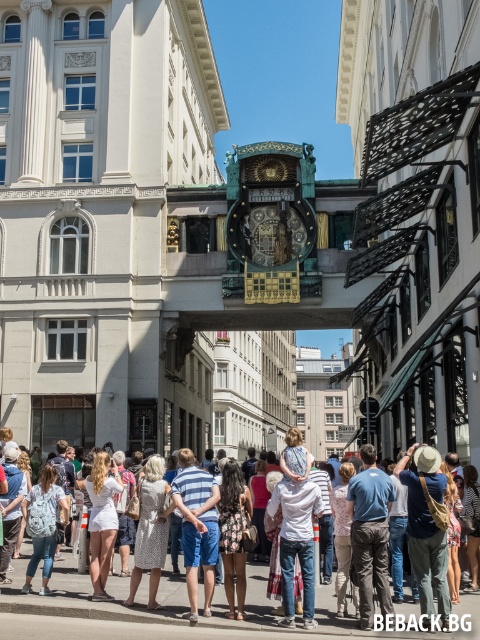
Question: Is denim backpack at lower left above white cotton shirt at center?

Choices:
 (A) no
 (B) yes

Answer: (A)

Question: Among these points, which one is nearest to the camera?

Choices:
 (A) (27, 515)
 (B) (179, 621)
 (C) (88, 486)

Answer: (B)

Question: Which point is closer to the camera?

Choices:
 (A) (106, 625)
 (B) (142, 536)
 (C) (344, 584)

Answer: (A)

Question: Can you confirm if denim jacket at center is thinner than white cotton dress at lower left?

Choices:
 (A) yes
 (B) no

Answer: (B)

Question: Which point is closer to the camera taking this photo?

Choices:
 (A) 446,600
 (B) 241,493
 (C) 94,552

Answer: (A)

Question: Is denim jacket at center above white cotton shirt at center?

Choices:
 (A) no
 (B) yes

Answer: (B)